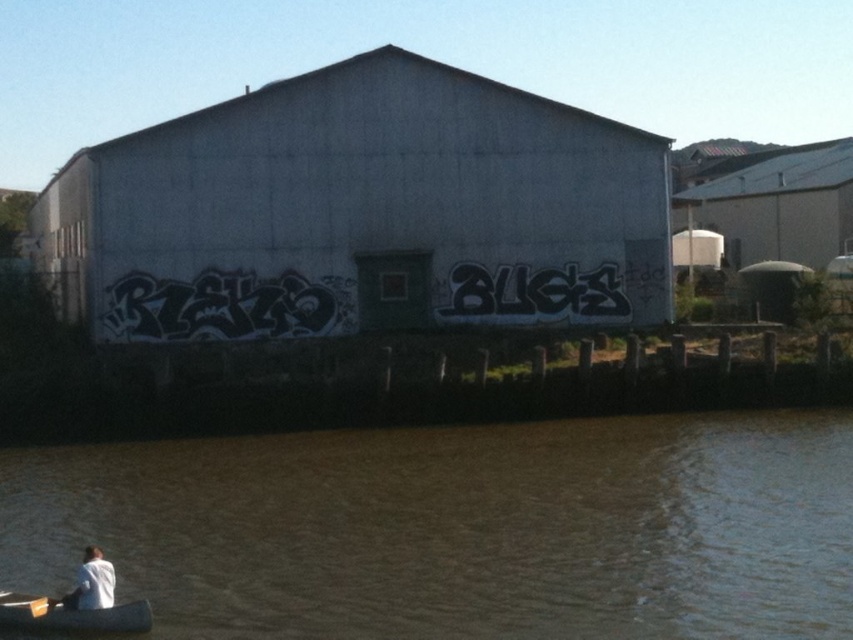
You are standing on the wooden pilings of the industrial building and notice a wooden canoe at lower left and a white matte shirt at lower left. Which object is taller from your viewpoint?

The white matte shirt at lower left is taller than the wooden canoe at lower left.

You are standing on the dock and see the brown murky water at lower left and the white matte shirt at lower left. Which object is taller?

The brown murky water at lower left is taller than the white matte shirt at lower left according to the description.